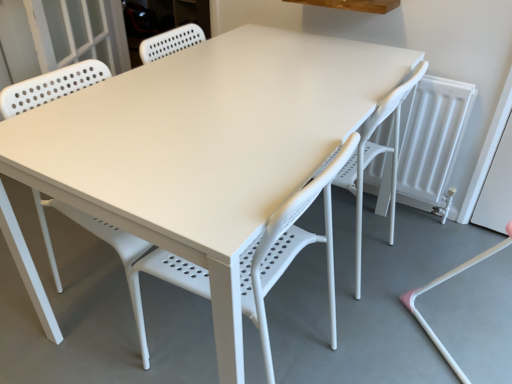
The width and height of the screenshot is (512, 384). Identify the location of free location to the right of white plastic swivel chair at lower right. (419, 248).